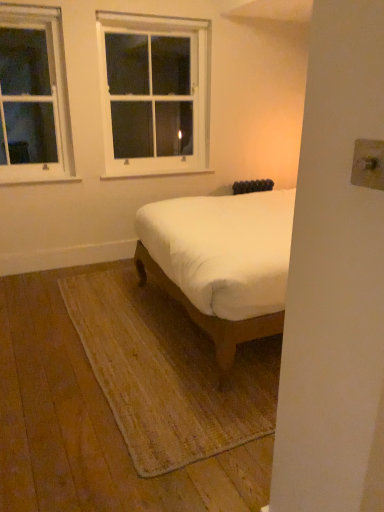
Question: Does white wood window at upper left, which is counted as the second window, starting from the right, have a lesser height compared to white wood window at upper center, the first window from the right?

Choices:
 (A) yes
 (B) no

Answer: (A)

Question: Can you confirm if white wood window at upper left, which is counted as the second window, starting from the right, is wider than white wood window at upper center, the 2th window positioned from the left?

Choices:
 (A) no
 (B) yes

Answer: (A)

Question: Does white wood window at upper left, which is counted as the second window, starting from the right, appear on the right side of white wood window at upper center, the 2th window positioned from the left?

Choices:
 (A) no
 (B) yes

Answer: (A)

Question: Is white wood window at upper left, acting as the 1th window starting from the left, positioned with its back to white wood window at upper center, the 2th window positioned from the left?

Choices:
 (A) no
 (B) yes

Answer: (A)

Question: Would you consider white wood window at upper left, acting as the 1th window starting from the left, to be distant from white wood window at upper center, the 2th window positioned from the left?

Choices:
 (A) no
 (B) yes

Answer: (A)

Question: Can you confirm if white wood window at upper left, acting as the 1th window starting from the left, is smaller than white wood window at upper center, the first window from the right?

Choices:
 (A) yes
 (B) no

Answer: (A)

Question: From the image's perspective, is white fabric bed at center on top of white wood window at upper center, the first window from the right?

Choices:
 (A) yes
 (B) no

Answer: (B)

Question: From the image's perspective, would you say white fabric bed at center is shown under white wood window at upper center, the 2th window positioned from the left?

Choices:
 (A) no
 (B) yes

Answer: (B)

Question: Is white fabric bed at center not near white wood window at upper center, the first window from the right?

Choices:
 (A) no
 (B) yes

Answer: (B)

Question: From a real-world perspective, is white fabric bed at center over white wood window at upper center, the 2th window positioned from the left?

Choices:
 (A) yes
 (B) no

Answer: (B)

Question: Considering the relative sizes of white fabric bed at center and white wood window at upper center, the first window from the right, in the image provided, is white fabric bed at center thinner than white wood window at upper center, the first window from the right,?

Choices:
 (A) no
 (B) yes

Answer: (A)

Question: Does white fabric bed at center have a lesser height compared to white wood window at upper center, the first window from the right?

Choices:
 (A) yes
 (B) no

Answer: (A)

Question: Considering the relative sizes of white wood window at upper left, which is counted as the second window, starting from the right, and white fabric bed at center in the image provided, is white wood window at upper left, which is counted as the second window, starting from the right, taller than white fabric bed at center?

Choices:
 (A) yes
 (B) no

Answer: (A)